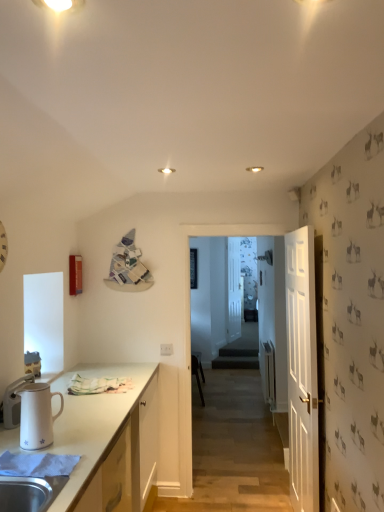
Question: Does white matte clock at left lie behind white glossy pitcher at left?

Choices:
 (A) no
 (B) yes

Answer: (B)

Question: Is white matte clock at left far away from white glossy pitcher at left?

Choices:
 (A) no
 (B) yes

Answer: (A)

Question: Considering the relative sizes of white matte clock at left and white glossy pitcher at left in the image provided, is white matte clock at left bigger than white glossy pitcher at left?

Choices:
 (A) no
 (B) yes

Answer: (A)

Question: From the image's perspective, would you say white matte clock at left is positioned over white glossy pitcher at left?

Choices:
 (A) no
 (B) yes

Answer: (B)

Question: Is white matte clock at left at the left side of white glossy pitcher at left?

Choices:
 (A) yes
 (B) no

Answer: (A)

Question: From the image's perspective, is black plastic chair at center above or below white wooden door at right?

Choices:
 (A) above
 (B) below

Answer: (B)

Question: Is point (203, 404) closer or farther from the camera than point (288, 349)?

Choices:
 (A) farther
 (B) closer

Answer: (A)

Question: Looking at the image, does black plastic chair at center seem bigger or smaller compared to white wooden door at right?

Choices:
 (A) small
 (B) big

Answer: (B)

Question: Relative to white wooden door at right, is black plastic chair at center in front or behind?

Choices:
 (A) front
 (B) behind

Answer: (B)

Question: Looking at their shapes, would you say white matte clock at left is wider or thinner than white glossy pitcher at left?

Choices:
 (A) wide
 (B) thin

Answer: (B)

Question: Visually, is white matte clock at left positioned to the left or to the right of white glossy pitcher at left?

Choices:
 (A) left
 (B) right

Answer: (A)

Question: Is white matte clock at left situated inside white glossy pitcher at left or outside?

Choices:
 (A) outside
 (B) inside

Answer: (A)

Question: Does point (1, 234) appear closer or farther from the camera than point (26, 385)?

Choices:
 (A) farther
 (B) closer

Answer: (A)

Question: From a real-world perspective, relative to white matte cabinet at lower left, is transparent glass door at center vertically above or below?

Choices:
 (A) above
 (B) below

Answer: (A)

Question: From the image's perspective, relative to white matte cabinet at lower left, is transparent glass door at center above or below?

Choices:
 (A) above
 (B) below

Answer: (A)